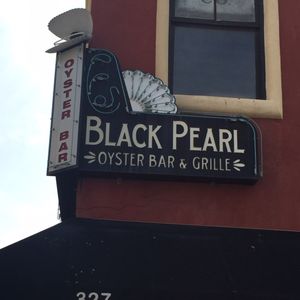
Image resolution: width=300 pixels, height=300 pixels. What are the coordinates of `red wall` in the screenshot? It's located at (281, 165).